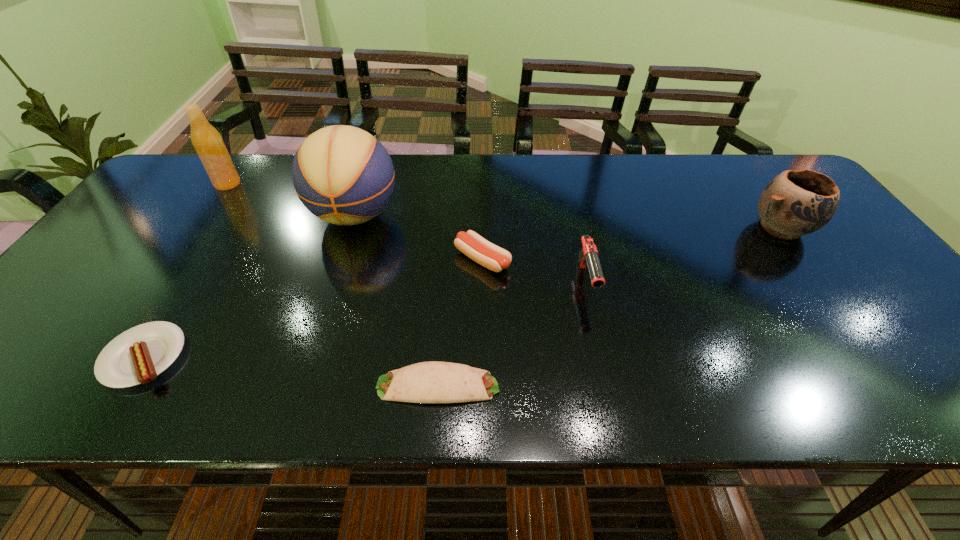
This screenshot has height=540, width=960. In order to click on blank space that satisfies the following two spatial constraints: 1. on the patterned surface of the basketball; 2. on the right side of the fifth shortest object in this screenshot , I will do `click(350, 228)`.